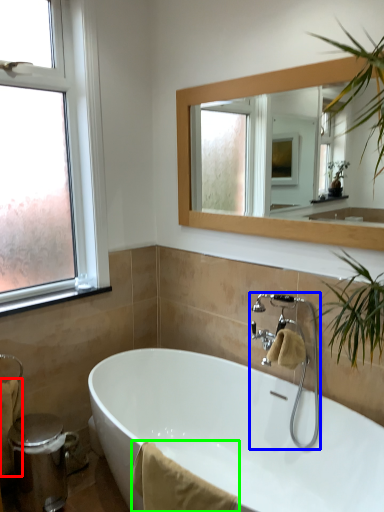
Question: Considering the real-world distances, which object is closest to bath towel (highlighted by a red box)? tap (highlighted by a blue box) or bath towel (highlighted by a green box).

Choices:
 (A) tap
 (B) bath towel

Answer: (B)